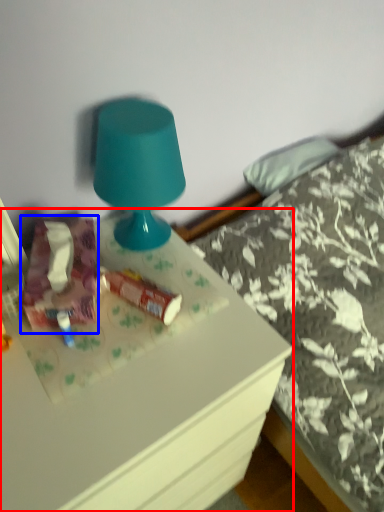
Question: Which point is closer to the camera, desk (highlighted by a red box) or stuff (highlighted by a blue box)?

Choices:
 (A) desk
 (B) stuff

Answer: (A)